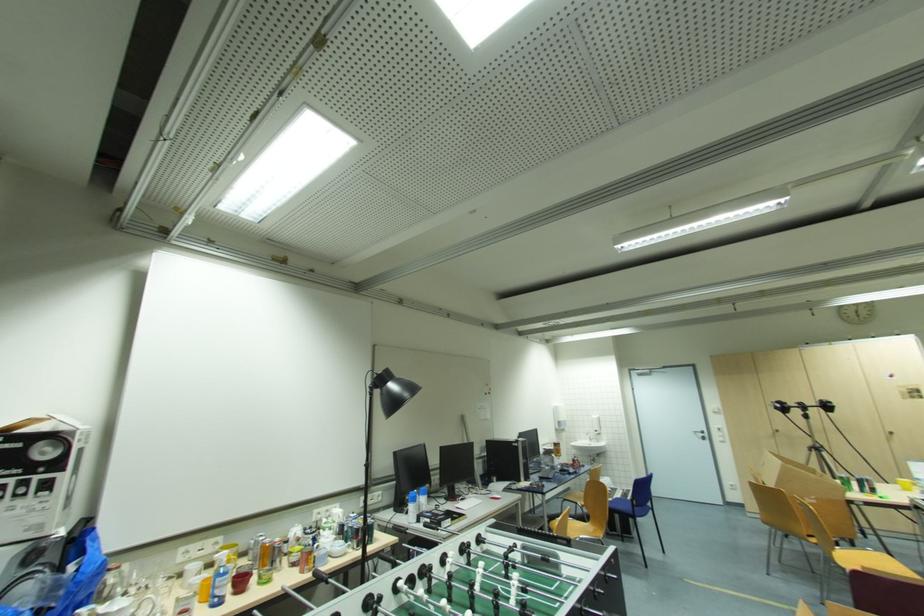
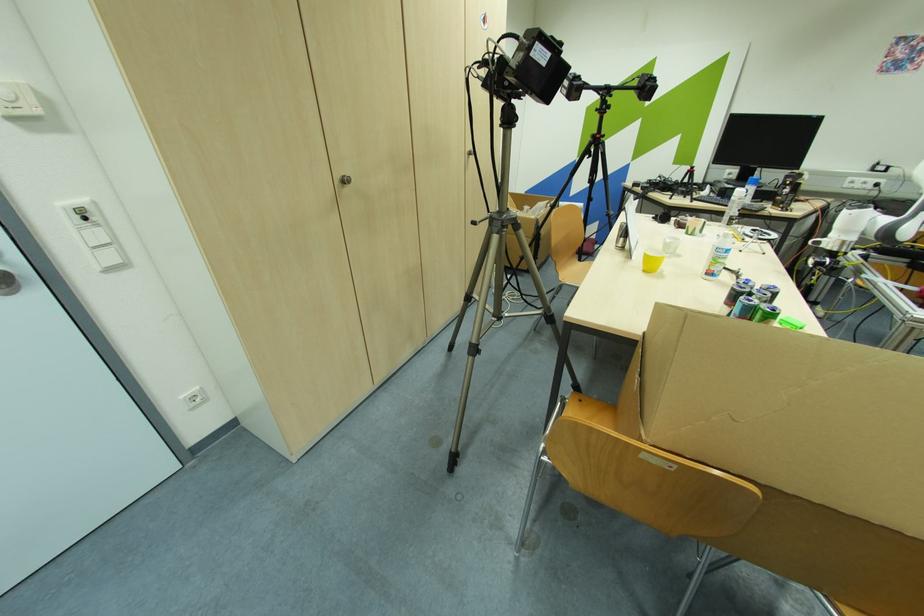
The point at (736, 485) is marked in the first image. Where is the corresponding point in the second image?

(198, 399)